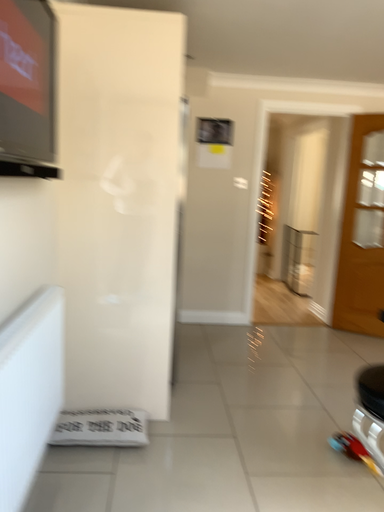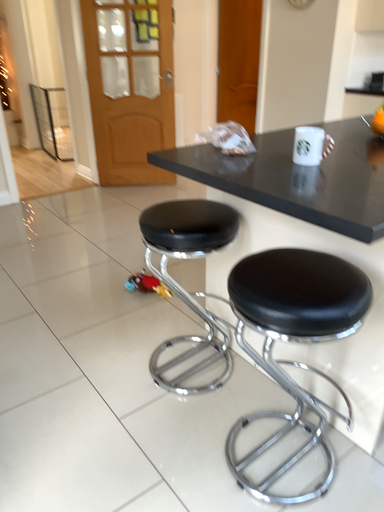
Question: How did the camera likely rotate when shooting the video?

Choices:
 (A) rotated upward
 (B) rotated downward

Answer: (B)